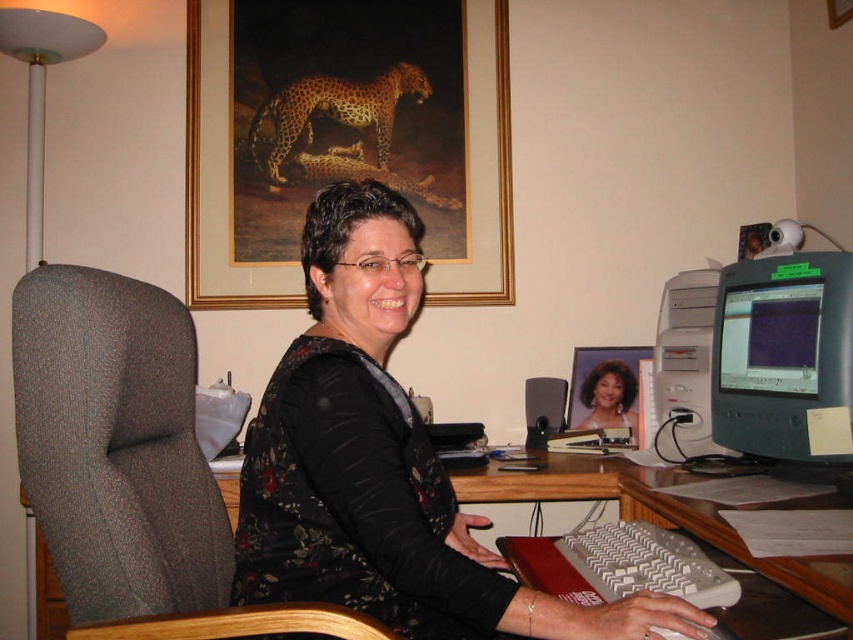
Is point (378, 202) farther from camera compared to point (741, 337)?

No, (378, 202) is closer to viewer.

From the picture: Between black floral dress at center and matte black monitor at right, which one is positioned higher?

matte black monitor at right is above.

The image size is (853, 640). Describe the element at coordinates (381, 464) in the screenshot. I see `black floral dress at center` at that location.

Find the location of a particular element. Image resolution: width=853 pixels, height=640 pixels. black floral dress at center is located at coordinates (381, 464).

Between matte black monitor at right and matte plastic monitor at center right, which one appears on the left side from the viewer's perspective?

matte plastic monitor at center right is more to the left.

Is matte black monitor at right wider than matte plastic monitor at center right?

Yes.

This screenshot has height=640, width=853. What are the coordinates of `matte black monitor at right` in the screenshot? It's located at (784, 356).

Is point (281, 28) behind point (814, 349)?

Yes, it is.

Between point (376, 179) and point (848, 458), which one is positioned behind?

The point (376, 179) is more distant.

Find the location of a particular element. This screenshot has width=853, height=640. gold-framed picture at upper center is located at coordinates (345, 138).